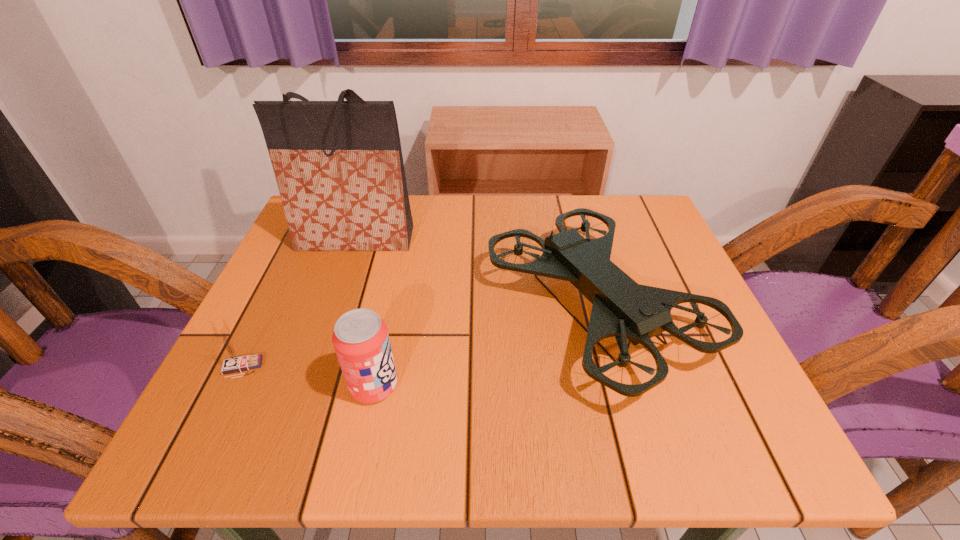
The width and height of the screenshot is (960, 540). I want to click on drone located at the far edge, so 622,308.

The height and width of the screenshot is (540, 960). I want to click on drone present at the near edge, so click(x=622, y=308).

This screenshot has width=960, height=540. What are the coordinates of `soda can that is at the near edge` in the screenshot? It's located at (361, 341).

Locate an element on the screen. The width and height of the screenshot is (960, 540). shopping bag present at the left edge is located at coordinates (339, 168).

The image size is (960, 540). Find the location of `matchbox located at the left edge`. matchbox located at the left edge is located at coordinates (234, 362).

Locate an element on the screen. object situated at the right edge is located at coordinates tap(622, 308).

Find the location of a particular element. The width and height of the screenshot is (960, 540). object that is at the far left corner is located at coordinates tap(339, 168).

The image size is (960, 540). Identify the location of object at the far right corner. (622, 308).

This screenshot has height=540, width=960. Identify the location of object that is positioned at the near right corner. (622, 308).

The image size is (960, 540). I want to click on free region at the far edge, so click(515, 242).